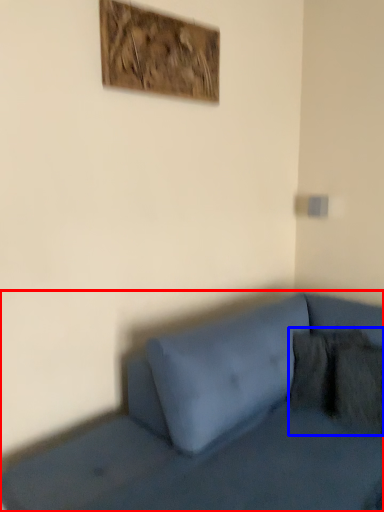
Question: Among these objects, which one is farthest to the camera, studio couch (highlighted by a red box) or pillow (highlighted by a blue box)?

Choices:
 (A) studio couch
 (B) pillow

Answer: (B)